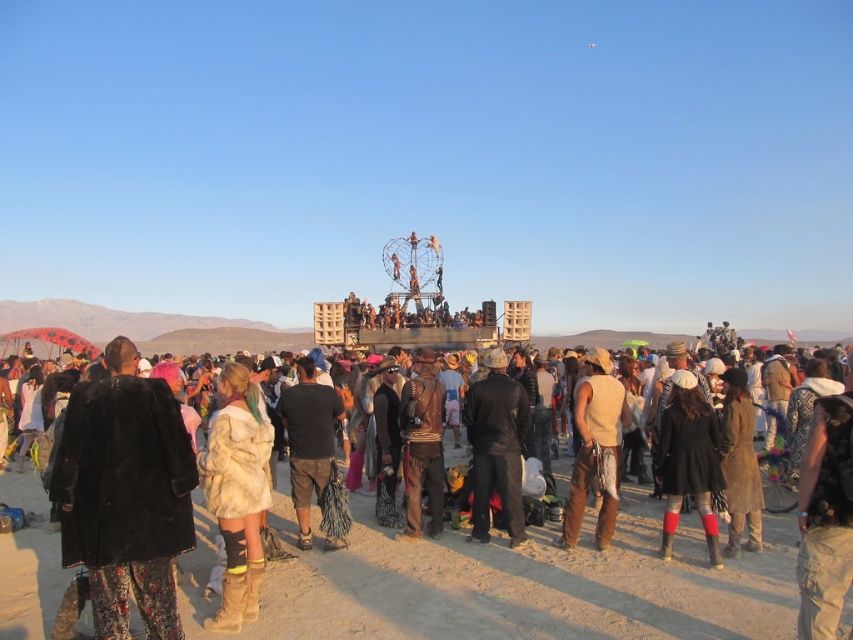
You are a photographer at the event and want to capture both the fuzzy black coat at lower left and the brown leather vest at center in your shot. Which of the two items should you focus on first if you want to ensure they are both in frame without adjusting your camera angle?

The fuzzy black coat at lower left is taller than the brown leather vest at center, so you should focus on the fuzzy black coat at lower left first to ensure both are in frame.

In the scene shown: You are at the event and want to take a photo of both the fuzzy beige coat at center and the black leather jacket at center. Since you can only focus on one at a time, which one should you focus on first to ensure the other is in the background?

The fuzzy beige coat at center is located below the black leather jacket at center, so you should focus on the black leather jacket at center first to have the fuzzy beige coat at center in the background.